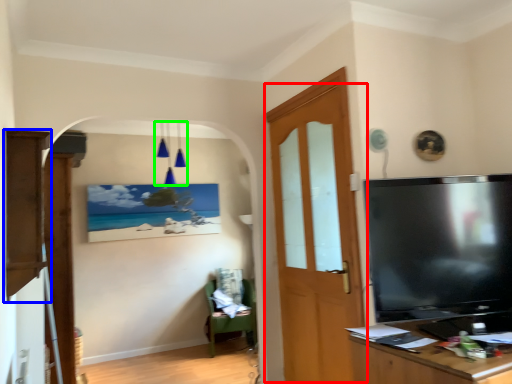
Question: Estimate the real-world distances between objects in this image. Which object is closer to door (highlighted by a red box), cabinetry (highlighted by a blue box) or light fixture (highlighted by a green box)?

Choices:
 (A) cabinetry
 (B) light fixture

Answer: (A)